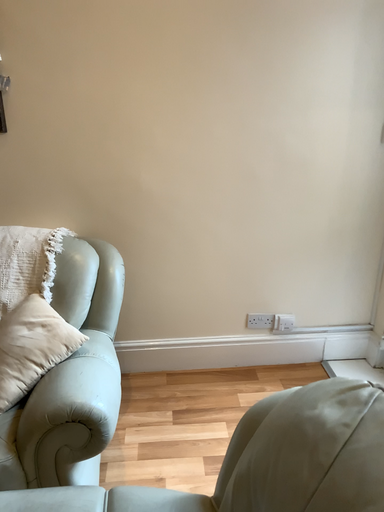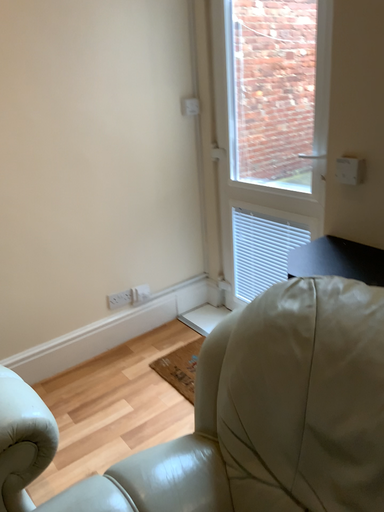
Question: Which way did the camera rotate in the video?

Choices:
 (A) rotated right
 (B) rotated left

Answer: (A)